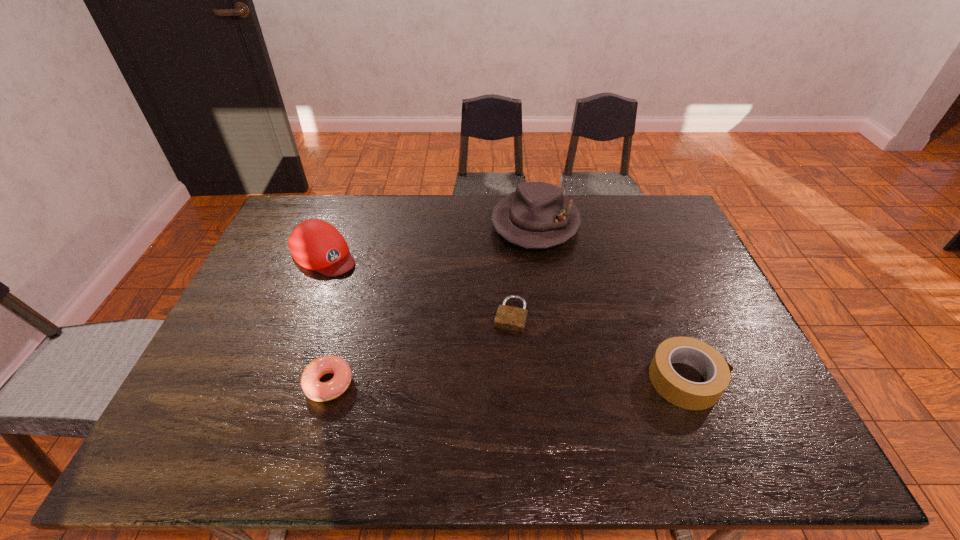
The image size is (960, 540). I want to click on duct tape present at the near edge, so click(x=715, y=370).

Locate an element on the screen. Image resolution: width=960 pixels, height=540 pixels. object present at the left edge is located at coordinates (315, 244).

Locate an element on the screen. This screenshot has width=960, height=540. object that is at the right edge is located at coordinates coord(715,370).

Image resolution: width=960 pixels, height=540 pixels. I want to click on object that is positioned at the far left corner, so click(315, 244).

What are the coordinates of `object positioned at the near right corner` in the screenshot? It's located at (715, 370).

Identify the location of free space at the far edge of the desktop. (350, 226).

In the image, there is a desktop. Find the location of `vacant space at the left edge`. vacant space at the left edge is located at coordinates (285, 294).

The height and width of the screenshot is (540, 960). Find the location of `vacant point at the right edge`. vacant point at the right edge is located at coordinates (740, 338).

Find the location of a particular element. free space at the far left corner is located at coordinates click(x=308, y=206).

Locate an element on the screen. This screenshot has height=540, width=960. vacant space at the far right corner of the desktop is located at coordinates [631, 200].